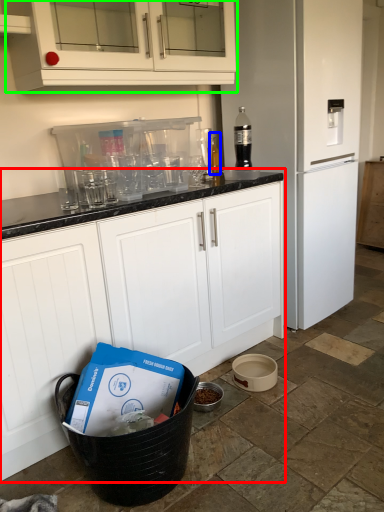
Question: Which object is the farthest from cabinetry (highlighted by a red box)? Choose among these: bottle (highlighted by a blue box) or cabinetry (highlighted by a green box).

Choices:
 (A) bottle
 (B) cabinetry

Answer: (A)